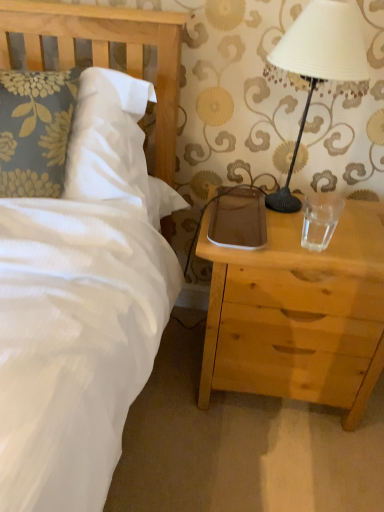
The image size is (384, 512). What do you see at coordinates (238, 219) in the screenshot?
I see `brown leather pad at right` at bounding box center [238, 219].

At what (x,y) coordinates should I click in order to perform the action: click on brown leather pad at right. Please return your answer as a coordinate pair (x, y). This screenshot has width=384, height=512. Looking at the image, I should click on (238, 219).

Where is `white matte lampshade at upper right`? white matte lampshade at upper right is located at coordinates (318, 64).

What are the coordinates of `wooden headboard at upper left` in the screenshot? It's located at (106, 51).

The height and width of the screenshot is (512, 384). Describe the element at coordinates (320, 219) in the screenshot. I see `transparent glass at right` at that location.

In order to face transparent glass at right, should I rotate leftwards or rightwards?

Rotate right and turn 16.574 degrees.

What are the coordinates of `light wood nightstand at right` in the screenshot? It's located at (298, 313).

How different are the orientations of light wood nightstand at right and white matte lampshade at upper right in degrees?

The angle between the facing direction of light wood nightstand at right and the facing direction of white matte lampshade at upper right is 0.507 degrees.

Is light wood nightstand at right wider than white matte lampshade at upper right?

Indeed, light wood nightstand at right has a greater width compared to white matte lampshade at upper right.

Considering the relative positions of light wood nightstand at right and white matte lampshade at upper right in the image provided, is light wood nightstand at right to the left or to the right of white matte lampshade at upper right?

Clearly, light wood nightstand at right is on the right of white matte lampshade at upper right in the image.

The width and height of the screenshot is (384, 512). Find the location of `lamp to the left of light wood nightstand at right`. lamp to the left of light wood nightstand at right is located at coordinates (318, 64).

Would you say brown leather pad at right is outside transparent glass at right?

Yes, brown leather pad at right is located beyond the bounds of transparent glass at right.

From a real-world perspective, relative to transparent glass at right, is brown leather pad at right vertically above or below?

Clearly, from a real-world perspective, brown leather pad at right is below transparent glass at right.

Image resolution: width=384 pixels, height=512 pixels. I want to click on pad on the left side of transparent glass at right, so click(238, 219).

Does point (213, 225) come behind point (318, 217)?

No, (213, 225) is in front of (318, 217).

Considering the relative sizes of light wood nightstand at right and wooden headboard at upper left in the image provided, is light wood nightstand at right thinner than wooden headboard at upper left?

No, light wood nightstand at right is not thinner than wooden headboard at upper left.

Could you tell me if light wood nightstand at right is turned towards wooden headboard at upper left?

No, light wood nightstand at right is not oriented towards wooden headboard at upper left.

From the picture: From the image's perspective, is light wood nightstand at right under wooden headboard at upper left?

Yes.

From a real-world perspective, which is physically above, white matte lampshade at upper right or light wood nightstand at right?

white matte lampshade at upper right is physically above.

Looking at this image, is white matte lampshade at upper right inside the boundaries of light wood nightstand at right, or outside?

white matte lampshade at upper right is not inside light wood nightstand at right, it's outside.

Who is bigger, white matte lampshade at upper right or light wood nightstand at right?

light wood nightstand at right.

Considering the relative sizes of white matte lampshade at upper right and light wood nightstand at right in the image provided, is white matte lampshade at upper right thinner than light wood nightstand at right?

Correct, the width of white matte lampshade at upper right is less than that of light wood nightstand at right.

In the image, there is a transparent glass at right. Where is `lamp above it (from the image's perspective)`? lamp above it (from the image's perspective) is located at coordinates (318, 64).

Is transparent glass at right inside or outside of white matte lampshade at upper right?

transparent glass at right is spatially situated outside white matte lampshade at upper right.

From the image's perspective, is transparent glass at right on top of white matte lampshade at upper right?

No, from the image's perspective, transparent glass at right is not over white matte lampshade at upper right.

Considering the sizes of transparent glass at right and white matte lampshade at upper right in the image, is transparent glass at right taller or shorter than white matte lampshade at upper right?

In the image, transparent glass at right appears to be shorter than white matte lampshade at upper right.

In the scene shown: Considering the sizes of objects transparent glass at right and brown leather pad at right in the image provided, who is taller, transparent glass at right or brown leather pad at right?

With more height is transparent glass at right.

Considering the sizes of objects transparent glass at right and brown leather pad at right in the image provided, who is bigger, transparent glass at right or brown leather pad at right?

With larger size is brown leather pad at right.

Would you say transparent glass at right is a long distance from brown leather pad at right?

That's not correct — transparent glass at right is a little close to brown leather pad at right.

What are the coordinates of `coffee cup behind the white matte lampshade at upper right` in the screenshot? It's located at (320, 219).

Does white matte lampshade at upper right contain transparent glass at right?

No, transparent glass at right is not inside white matte lampshade at upper right.

In the scene shown: Does white matte lampshade at upper right appear on the left side of transparent glass at right?

Yes.

Which is in front, white matte lampshade at upper right or transparent glass at right?

white matte lampshade at upper right is more forward.

This screenshot has height=512, width=384. I want to click on nightstand below the white matte lampshade at upper right (from a real-world perspective), so click(x=298, y=313).

Where is `coffee cup on the right of brown leather pad at right`? The height and width of the screenshot is (512, 384). coffee cup on the right of brown leather pad at right is located at coordinates (320, 219).

From the image, which object appears to be nearer to light wood nightstand at right, white matte lampshade at upper right or wooden headboard at upper left?

white matte lampshade at upper right is positioned closer to the anchor light wood nightstand at right.

In the scene shown: Estimate the real-world distances between objects in this image. Which object is closer to white matte lampshade at upper right, brown leather pad at right or transparent glass at right?

brown leather pad at right lies closer to white matte lampshade at upper right than the other object.

Which object lies nearer to the anchor point light wood nightstand at right, wooden headboard at upper left or white matte lampshade at upper right?

white matte lampshade at upper right.

From the image, which object appears to be nearer to light wood nightstand at right, white matte lampshade at upper right or transparent glass at right?

transparent glass at right lies closer to light wood nightstand at right than the other object.

Consider the image. From the image, which object appears to be nearer to white matte lampshade at upper right, transparent glass at right or light wood nightstand at right?

Based on the image, transparent glass at right appears to be nearer to white matte lampshade at upper right.

Based on their spatial positions, is wooden headboard at upper left or brown leather pad at right closer to white matte lampshade at upper right?

brown leather pad at right lies closer to white matte lampshade at upper right than the other object.

When comparing their distances from brown leather pad at right, does transparent glass at right or wooden headboard at upper left seem further?

wooden headboard at upper left.

Looking at the image, which one is located further to brown leather pad at right, light wood nightstand at right or white matte lampshade at upper right?

Among the two, white matte lampshade at upper right is located further to brown leather pad at right.

Find the location of a particular element. coffee cup between brown leather pad at right and light wood nightstand at right from top to bottom is located at coordinates (320, 219).

You are a GUI agent. You are given a task and a screenshot of the screen. Output one action in this format:
    pyautogui.click(x=<x>, y=<y>)
    Task: Click on the pad between wooden headboard at upper left and white matte lampshade at upper right from left to right
    The width and height of the screenshot is (384, 512).
    Given the screenshot: What is the action you would take?
    pyautogui.click(x=238, y=219)

Where is `pad between white matte lampshade at upper right and transparent glass at right from top to bottom`? The height and width of the screenshot is (512, 384). pad between white matte lampshade at upper right and transparent glass at right from top to bottom is located at coordinates (238, 219).

Locate an element on the screen. This screenshot has width=384, height=512. lamp situated between wooden headboard at upper left and light wood nightstand at right from left to right is located at coordinates (318, 64).